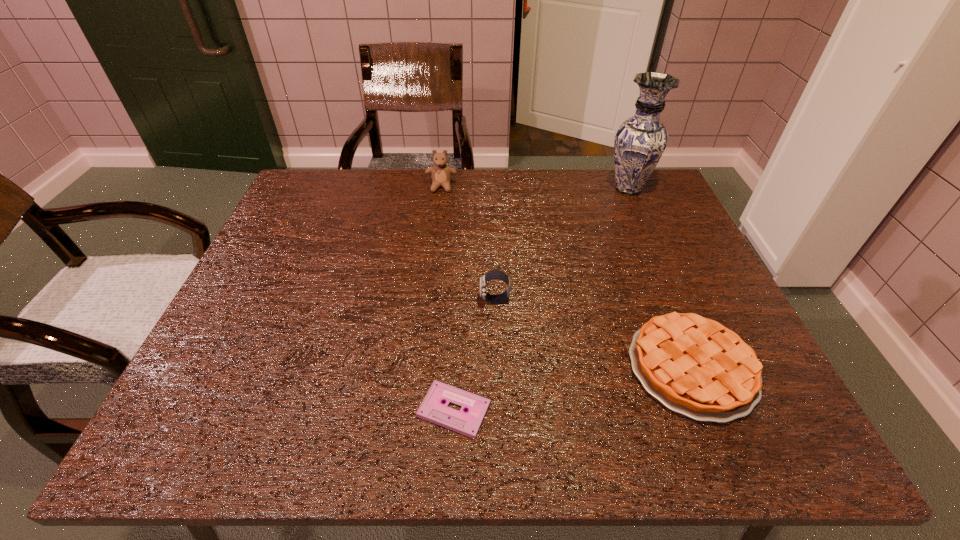
The width and height of the screenshot is (960, 540). I want to click on vacant space that satisfies the following two spatial constraints: 1. on the front side of the vase; 2. on the face of the third nearest object, so click(x=677, y=300).

I want to click on free spot that satisfies the following two spatial constraints: 1. on the front-facing side of the videotape; 2. on the right side of the teddy bear, so click(416, 410).

The width and height of the screenshot is (960, 540). In order to click on free space that satisfies the following two spatial constraints: 1. on the back side of the videotape; 2. on the left side of the vase in this screenshot , I will do `click(465, 188)`.